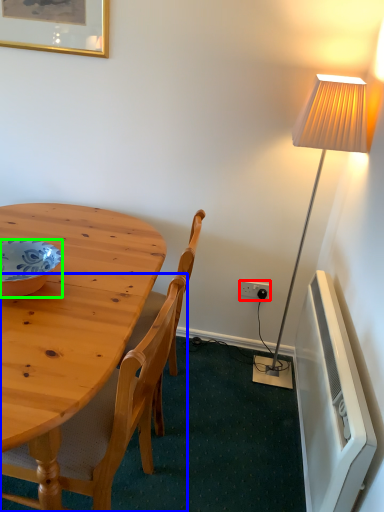
Question: Estimate the real-world distances between objects in this image. Which object is closer to power outlet (highlighted by a red box), chair (highlighted by a blue box) or bowl (highlighted by a green box)?

Choices:
 (A) chair
 (B) bowl

Answer: (A)